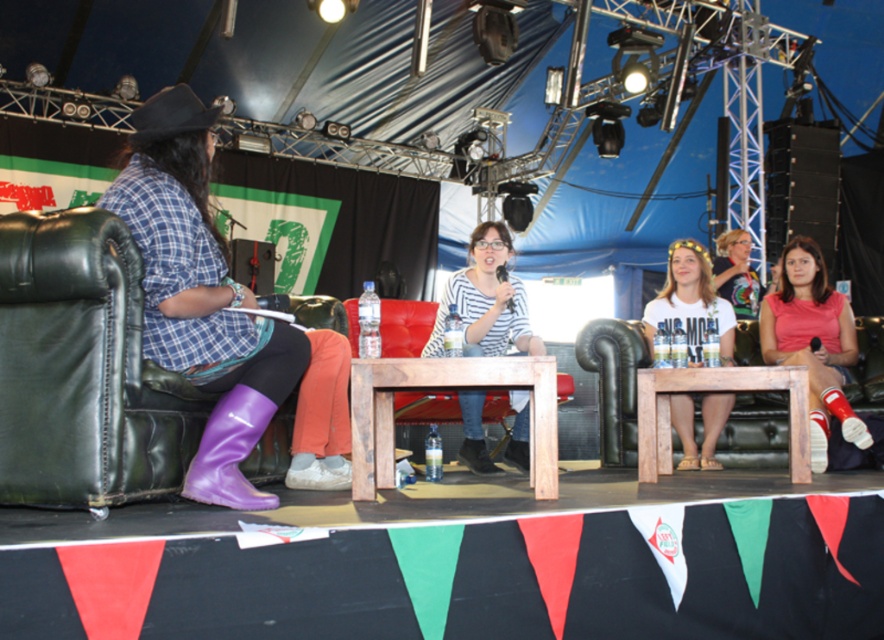
Question: Does purple rubber boots at left come behind white cotton t-shirt at center?

Choices:
 (A) no
 (B) yes

Answer: (A)

Question: Which object is the farthest from the striped cotton shirt at center?

Choices:
 (A) purple rubber boots at left
 (B) purple rubber boot at lower left

Answer: (B)

Question: Among these objects, which one is nearest to the camera?

Choices:
 (A) purple rubber boot at lower left
 (B) striped cotton shirt at center
 (C) pink fabric shirt at center

Answer: (A)

Question: Is purple rubber boots at left positioned behind striped cotton shirt at center?

Choices:
 (A) yes
 (B) no

Answer: (B)

Question: Which of these objects is positioned closest to the purple rubber boot at lower left?

Choices:
 (A) striped cotton shirt at center
 (B) pink fabric shirt at center

Answer: (A)

Question: Where is pink fabric shirt at center located in relation to white cotton t-shirt at center in the image?

Choices:
 (A) right
 (B) left

Answer: (A)